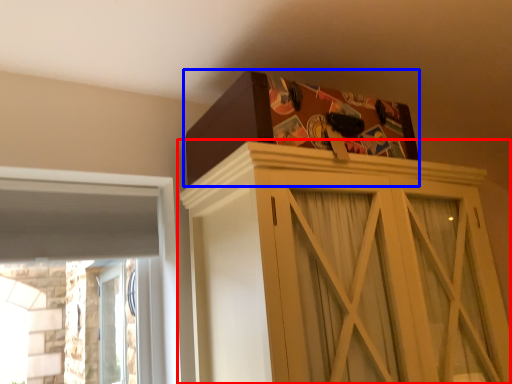
Question: Which object is closer to the camera taking this photo, cupboard (highlighted by a red box) or cardboard box (highlighted by a blue box)?

Choices:
 (A) cupboard
 (B) cardboard box

Answer: (A)